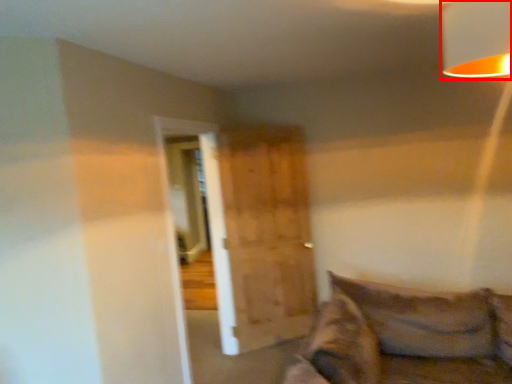
Question: From the image's perspective, where is lamp (annotated by the red box) located in relation to barn door in the image?

Choices:
 (A) above
 (B) below

Answer: (A)